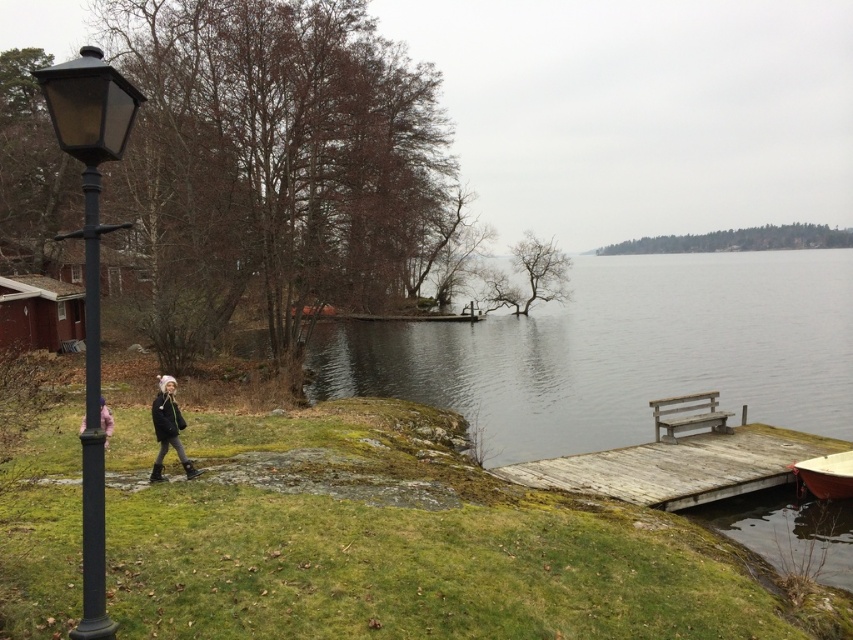
Question: Does black metal lamp post at left appear on the right side of white wooden boat at lower right?

Choices:
 (A) no
 (B) yes

Answer: (A)

Question: Does black metal pole at left appear under pink fabric jacket at lower left?

Choices:
 (A) yes
 (B) no

Answer: (B)

Question: Does black metal lamp post at left have a smaller size compared to dark gray knit hat at lower left?

Choices:
 (A) yes
 (B) no

Answer: (B)

Question: Which object is farther from the camera taking this photo?

Choices:
 (A) black metal lamp post at left
 (B) pink fabric jacket at lower left
 (C) wooden bench at lower right

Answer: (C)

Question: Which point is closer to the camera?

Choices:
 (A) wooden dock at lower right
 (B) wooden bench at lower right

Answer: (A)

Question: Which object is positioned farthest from the wooden bench at lower right?

Choices:
 (A) white wooden boat at lower right
 (B) dark gray knit hat at lower left
 (C) wooden dock at lower right
 (D) black metal lamp post at left

Answer: (D)